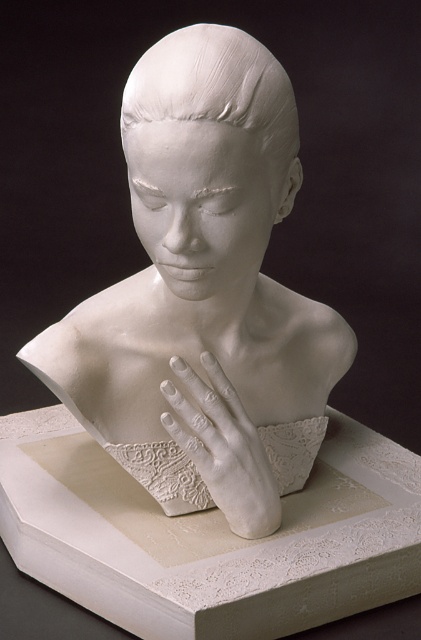
Question: Observing the image, what is the correct spatial positioning of white matte sculpture at center in reference to white matte hand at center?

Choices:
 (A) right
 (B) left

Answer: (B)

Question: Among these objects, which one is nearest to the camera?

Choices:
 (A) white matte bust at center
 (B) white matte hand at center
 (C) white matte sculpture at center

Answer: (C)

Question: Which of the following is the closest to the observer?

Choices:
 (A) white matte sculpture at center
 (B) white matte hand at center

Answer: (A)

Question: Can you confirm if white matte bust at center is wider than white matte hand at center?

Choices:
 (A) no
 (B) yes

Answer: (B)

Question: Is white matte bust at center further to camera compared to white matte sculpture at center?

Choices:
 (A) yes
 (B) no

Answer: (A)

Question: Which of the following is the farthest from the observer?

Choices:
 (A) (314, 438)
 (B) (210, 88)

Answer: (A)